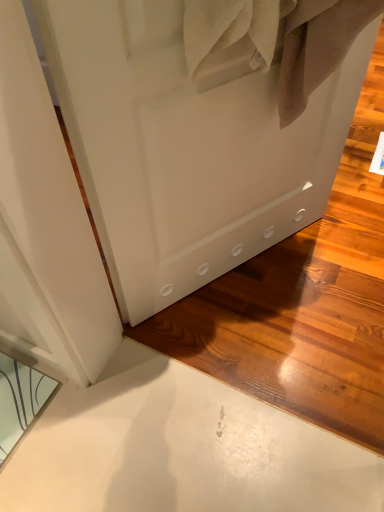
Question: Is white matte door at center further to camera compared to clear glass mirror at lower left?

Choices:
 (A) no
 (B) yes

Answer: (A)

Question: Does white matte door at center come in front of clear glass mirror at lower left?

Choices:
 (A) no
 (B) yes

Answer: (B)

Question: From the image's perspective, would you say white matte door at center is positioned over clear glass mirror at lower left?

Choices:
 (A) yes
 (B) no

Answer: (A)

Question: Is white matte door at center shorter than clear glass mirror at lower left?

Choices:
 (A) no
 (B) yes

Answer: (A)

Question: Does white matte door at center have a larger size compared to clear glass mirror at lower left?

Choices:
 (A) no
 (B) yes

Answer: (B)

Question: Is white matte door at center far from clear glass mirror at lower left?

Choices:
 (A) no
 (B) yes

Answer: (A)

Question: Is clear glass mirror at lower left taller than white matte door at center?

Choices:
 (A) yes
 (B) no

Answer: (B)

Question: Does clear glass mirror at lower left have a smaller size compared to white matte door at center?

Choices:
 (A) no
 (B) yes

Answer: (B)

Question: Is clear glass mirror at lower left located outside white matte door at center?

Choices:
 (A) yes
 (B) no

Answer: (A)

Question: Is clear glass mirror at lower left far from white matte door at center?

Choices:
 (A) no
 (B) yes

Answer: (A)

Question: Considering the relative sizes of clear glass mirror at lower left and white matte door at center in the image provided, is clear glass mirror at lower left wider than white matte door at center?

Choices:
 (A) no
 (B) yes

Answer: (B)

Question: Is white matte door at center at the back of clear glass mirror at lower left?

Choices:
 (A) yes
 (B) no

Answer: (B)

Question: Do you think clear glass mirror at lower left is within white matte door at center, or outside of it?

Choices:
 (A) inside
 (B) outside

Answer: (B)